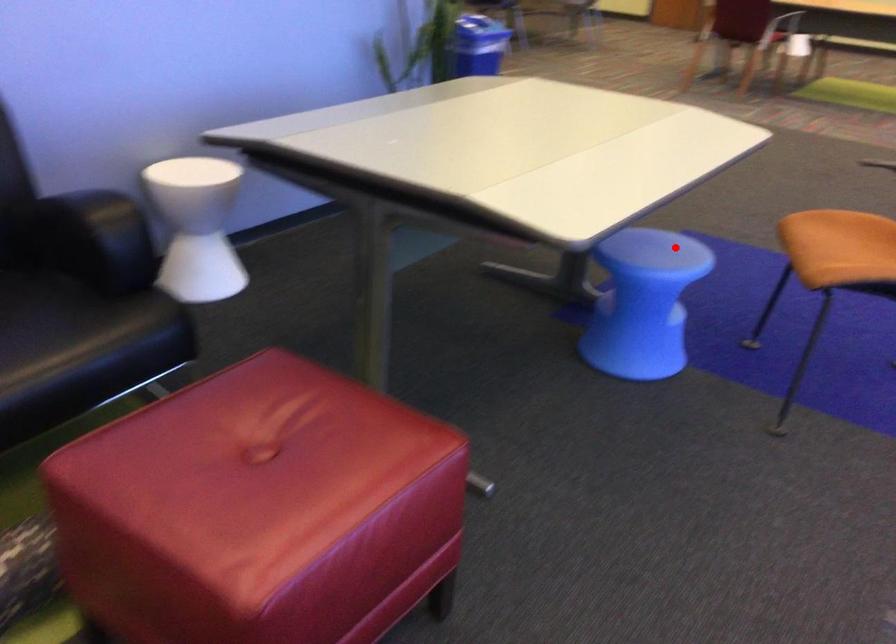
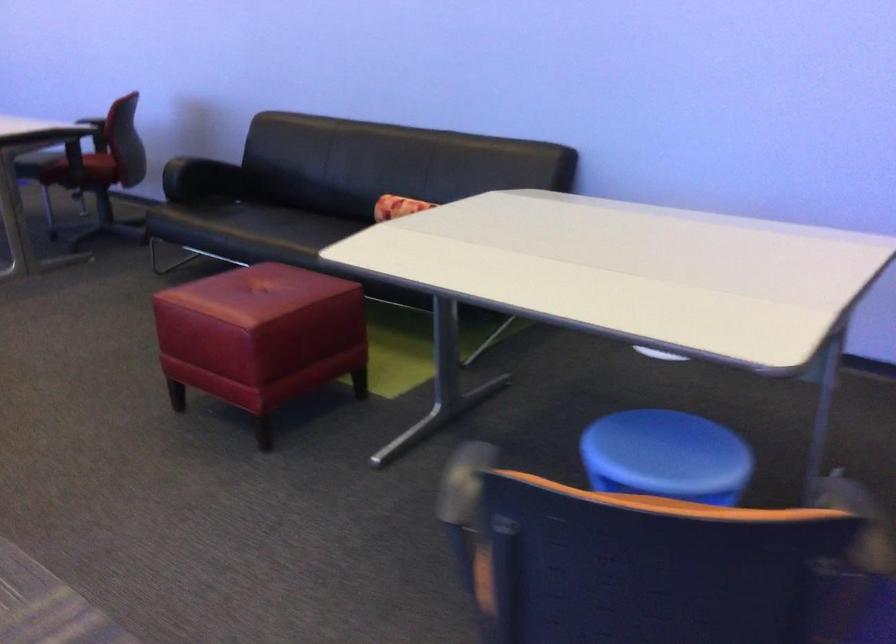
Where in the second image is the point corresponding to the highlighted location from the first image?

(666, 456)